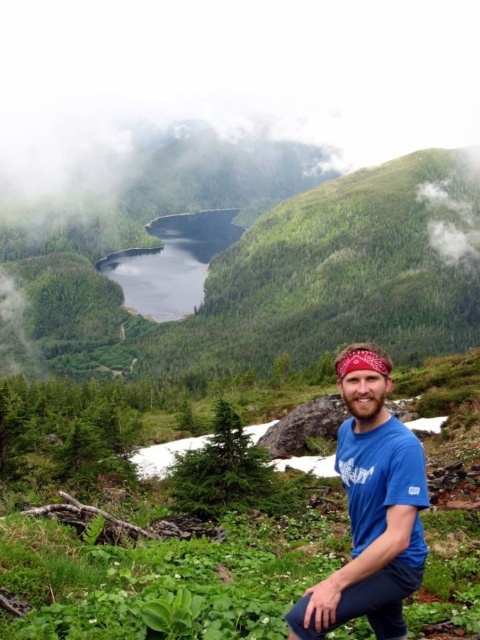
Question: Observing the image, what is the correct spatial positioning of blue cotton shirt at center in reference to deep blue water at center?

Choices:
 (A) left
 (B) right

Answer: (B)

Question: Can you confirm if blue cotton shirt at center is positioned below deep blue water at center?

Choices:
 (A) no
 (B) yes

Answer: (B)

Question: Does blue cotton shirt at center appear on the left side of deep blue water at center?

Choices:
 (A) no
 (B) yes

Answer: (A)

Question: Which point is farther to the camera?

Choices:
 (A) deep blue water at center
 (B) blue cotton shirt at center

Answer: (A)

Question: Which object is closer to the camera taking this photo?

Choices:
 (A) deep blue water at center
 (B) blue cotton shirt at center

Answer: (B)